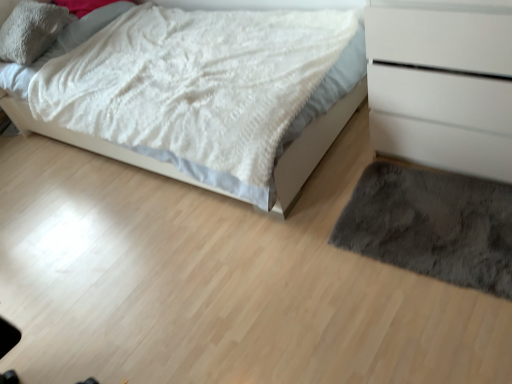
Question: Is point pyautogui.click(x=117, y=158) positioned closer to the camera than point pyautogui.click(x=455, y=97)?

Choices:
 (A) closer
 (B) farther

Answer: (B)

Question: Based on their positions, is white fluffy blanket at upper left located to the left or right of white matte chest of drawers at right?

Choices:
 (A) right
 (B) left

Answer: (B)

Question: Which of these objects is positioned closest to the white fluffy blanket at upper left?

Choices:
 (A) white matte chest of drawers at right
 (B) soft gray plush pillow at upper left
 (C) dark gray shaggy rug at lower right

Answer: (A)

Question: Estimate the real-world distances between objects in this image. Which object is farther from the dark gray shaggy rug at lower right?

Choices:
 (A) white fluffy blanket at upper left
 (B) soft gray plush pillow at upper left
 (C) white matte chest of drawers at right

Answer: (B)